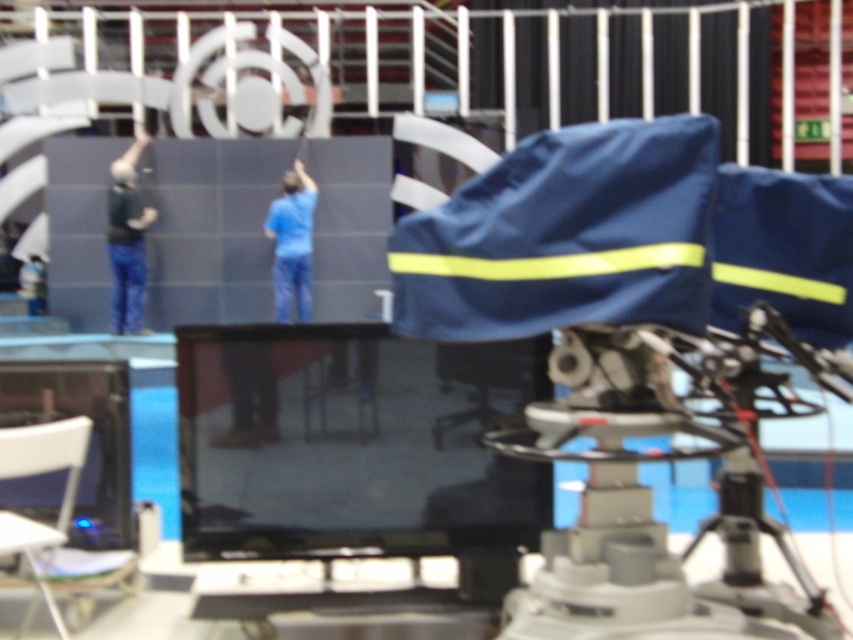
What do you see at coordinates (757, 545) in the screenshot? I see `metallic tripod at center` at bounding box center [757, 545].

Does metallic tripod at center come behind dark blue jeans at left?

No, metallic tripod at center is closer to the viewer.

Locate an element on the screen. The height and width of the screenshot is (640, 853). metallic tripod at center is located at coordinates coord(757,545).

You are a GUI agent. You are given a task and a screenshot of the screen. Output one action in this format:
    pyautogui.click(x=<x>, y=<y>)
    Task: Click on the metallic tripod at center
    
    Given the screenshot: What is the action you would take?
    pyautogui.click(x=757, y=545)

Is metallic tripod at center in front of blue matte shirt at center?

Yes, metallic tripod at center is in front of blue matte shirt at center.

Describe the element at coordinates (757, 545) in the screenshot. I see `metallic tripod at center` at that location.

The height and width of the screenshot is (640, 853). Find the location of `metallic tripod at center`. metallic tripod at center is located at coordinates (757, 545).

Which is above, dark blue jeans at left or blue matte shirt at center?

dark blue jeans at left is higher up.

Does point (142, 134) lie in front of point (287, 294)?

No, (142, 134) is behind (287, 294).

Locate an element on the screen. This screenshot has height=640, width=853. dark blue jeans at left is located at coordinates (126, 240).